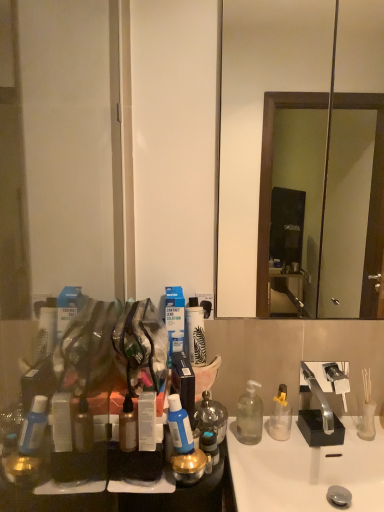
Find the location of a particular element. This screenshot has height=512, width=384. blue translucent bottle at center, which is the 2th bottle in front-to-back order is located at coordinates (179, 426).

Image resolution: width=384 pixels, height=512 pixels. What are the coordinates of `transparent plastic container at center` in the screenshot? It's located at (147, 421).

Identify the location of wooden framed mirror at center. Image resolution: width=384 pixels, height=512 pixels. (259, 119).

Which object is positioned more to the left, white glossy sink at lower center or blue translucent bottle at center, the 3th bottle in the back-to-front sequence?

blue translucent bottle at center, the 3th bottle in the back-to-front sequence, is more to the left.

Is blue translucent bottle at center, the 3th bottle in the back-to-front sequence, at the back of white glossy sink at lower center?

No, white glossy sink at lower center is not facing away from blue translucent bottle at center, the 3th bottle in the back-to-front sequence.

Is transparent glass bottle at lower right, which is the 2th bottle in back-to-front order, a part of blue translucent bottle at center, which is counted as the 3th bottle, starting from the right?

No, transparent glass bottle at lower right, which is the 2th bottle in back-to-front order, is located outside of blue translucent bottle at center, which is counted as the 3th bottle, starting from the right.

Where is `bottle that is the 3rd object located above the transparent glass bottle at lower right, the 3th bottle positioned from the left (from the image's perspective)`? Image resolution: width=384 pixels, height=512 pixels. bottle that is the 3rd object located above the transparent glass bottle at lower right, the 3th bottle positioned from the left (from the image's perspective) is located at coordinates (179, 426).

Between blue translucent bottle at center, which is the 2th bottle in front-to-back order, and transparent glass bottle at lower right, which is counted as the second bottle, starting from the right, which one has larger width?

transparent glass bottle at lower right, which is counted as the second bottle, starting from the right, is wider.

Is blue translucent bottle at center, the 3th bottle in the back-to-front sequence, taller than transparent glass bottle at lower right, which is the 2th bottle in back-to-front order?

No, blue translucent bottle at center, the 3th bottle in the back-to-front sequence, is not taller than transparent glass bottle at lower right, which is the 2th bottle in back-to-front order.

From the image's perspective, is blue translucent bottle at center, the 3th bottle in the back-to-front sequence, above or below metallic silver spray can at lower left, which is the first bottle in left-to-right order?

blue translucent bottle at center, the 3th bottle in the back-to-front sequence, is above metallic silver spray can at lower left, which is the first bottle in left-to-right order.

From a real-world perspective, is blue translucent bottle at center, positioned as the second bottle in left-to-right order, located higher than metallic silver spray can at lower left, the first bottle in the front-to-back sequence?

Yes, from a real-world perspective, blue translucent bottle at center, positioned as the second bottle in left-to-right order, is over metallic silver spray can at lower left, the first bottle in the front-to-back sequence

Which object is further away from the camera, blue translucent bottle at center, positioned as the second bottle in left-to-right order, or metallic silver spray can at lower left, which is the first bottle in left-to-right order?

blue translucent bottle at center, positioned as the second bottle in left-to-right order, is behind.

Is point (127, 399) closer to viewer compared to point (184, 411)?

That is True.

From the image's perspective, who appears lower, metallic silver spray can at lower left, the 4th bottle in the right-to-left sequence, or blue translucent bottle at center, which is the 2th bottle in front-to-back order?

From the image's view, metallic silver spray can at lower left, the 4th bottle in the right-to-left sequence, is below.

Who is bigger, metallic silver spray can at lower left, the 4th bottle in the right-to-left sequence, or blue translucent bottle at center, positioned as the second bottle in left-to-right order?

With larger size is blue translucent bottle at center, positioned as the second bottle in left-to-right order.

Which object is positioned more to the left, transparent glass bottle at lower right, which is the 2th bottle in back-to-front order, or wooden framed mirror at center?

transparent glass bottle at lower right, which is the 2th bottle in back-to-front order, is more to the left.

Which object is more forward, transparent glass bottle at lower right, which is counted as the second bottle, starting from the right, or wooden framed mirror at center?

wooden framed mirror at center is in front.

Is transparent glass bottle at lower right, which is counted as the second bottle, starting from the right, taller than wooden framed mirror at center?

No, transparent glass bottle at lower right, which is counted as the second bottle, starting from the right, is not taller than wooden framed mirror at center.

Measure the distance between transparent glass bottle at lower right, which is counted as the second bottle, starting from the right, and wooden framed mirror at center.

transparent glass bottle at lower right, which is counted as the second bottle, starting from the right, is 6.56 feet away from wooden framed mirror at center.

Considering the positions of objects metallic silver spray can at lower left, which is the first bottle in left-to-right order, and clear plastic bottle at center, the 1th bottle when ordered from right to left, in the image provided, who is behind, metallic silver spray can at lower left, which is the first bottle in left-to-right order, or clear plastic bottle at center, the 1th bottle when ordered from right to left,?

clear plastic bottle at center, the 1th bottle when ordered from right to left, is more distant.

Is point (120, 441) positioned behind point (278, 440)?

No, it is in front of (278, 440).

How many degrees apart are the facing directions of metallic silver spray can at lower left, the fourth bottle positioned from the back, and clear plastic bottle at center, the 1th bottle when ordered from right to left?

1.39 degrees separate the facing orientations of metallic silver spray can at lower left, the fourth bottle positioned from the back, and clear plastic bottle at center, the 1th bottle when ordered from right to left.

Is metallic silver spray can at lower left, which is the first bottle in left-to-right order, positioned far away from clear plastic bottle at center, which ranks as the fourth bottle in front-to-back order?

No.

Does wooden framed mirror at center have a greater height compared to metallic silver spray can at lower left, the fourth bottle positioned from the back?

Yes.

Is wooden framed mirror at center surrounding metallic silver spray can at lower left, the fourth bottle positioned from the back?

No.

Is point (357, 23) closer to camera compared to point (133, 436)?

No, (357, 23) is behind (133, 436).

Considering the positions of objects wooden framed mirror at center and metallic silver spray can at lower left, the 4th bottle in the right-to-left sequence, in the image provided, who is more to the left, wooden framed mirror at center or metallic silver spray can at lower left, the 4th bottle in the right-to-left sequence,?

metallic silver spray can at lower left, the 4th bottle in the right-to-left sequence.

The height and width of the screenshot is (512, 384). I want to click on bottle that is the 3rd object to the left of the white glossy sink at lower center, starting at the anchor, so click(x=179, y=426).

You are a GUI agent. You are given a task and a screenshot of the screen. Output one action in this format:
    pyautogui.click(x=<x>, y=<y>)
    Task: Click on the bottle that is the 3rd one when counting upward from the transparent glass bottle at lower right, which is the 2th bottle in back-to-front order (from the image's perspective)
    Image resolution: width=384 pixels, height=512 pixels.
    Given the screenshot: What is the action you would take?
    click(x=179, y=426)

Looking at the image, which one is located closer to transparent plastic container at center, transparent glass bottle at lower right, which is the third bottle in front-to-back order, or clear plastic bottle at center, the first bottle when ordered from back to front?

Based on the image, transparent glass bottle at lower right, which is the third bottle in front-to-back order, appears to be nearer to transparent plastic container at center.

Estimate the real-world distances between objects in this image. Which object is further from wooden framed mirror at center, clear plastic bottle at center, the first bottle when ordered from back to front, or metallic silver spray can at lower left, the 4th bottle in the right-to-left sequence?

metallic silver spray can at lower left, the 4th bottle in the right-to-left sequence, is further to wooden framed mirror at center.

When comparing their distances from white glossy sink at lower center, does clear plastic bottle at center, placed as the 4th bottle when sorted from left to right, or metallic silver spray can at lower left, which is the first bottle in left-to-right order, seem further?

metallic silver spray can at lower left, which is the first bottle in left-to-right order, is positioned further to the anchor white glossy sink at lower center.

Based on their spatial positions, is metallic silver spray can at lower left, which is the first bottle in left-to-right order, or transparent plastic container at center further from transparent glass bottle at lower right, which is the 2th bottle in back-to-front order?

metallic silver spray can at lower left, which is the first bottle in left-to-right order.

From the image, which object appears to be farther from transparent glass bottle at lower right, the 3th bottle positioned from the left, transparent plastic container at center or metallic silver spray can at lower left, which is the first bottle in left-to-right order?

Based on the image, metallic silver spray can at lower left, which is the first bottle in left-to-right order, appears to be further to transparent glass bottle at lower right, the 3th bottle positioned from the left.

Consider the image. When comparing their distances from transparent glass bottle at lower right, which is the 2th bottle in back-to-front order, does blue translucent bottle at center, which is counted as the 3th bottle, starting from the right, or white glossy sink at lower center seem closer?

The object closer to transparent glass bottle at lower right, which is the 2th bottle in back-to-front order, is white glossy sink at lower center.

Looking at the image, which one is located closer to blue translucent bottle at center, which is the 2th bottle in front-to-back order, transparent glass bottle at lower right, which is the third bottle in front-to-back order, or wooden framed mirror at center?

The object closer to blue translucent bottle at center, which is the 2th bottle in front-to-back order, is transparent glass bottle at lower right, which is the third bottle in front-to-back order.

When comparing their distances from metallic silver spray can at lower left, the first bottle in the front-to-back sequence, does transparent plastic container at center or transparent glass bottle at lower right, the 3th bottle positioned from the left, seem further?

transparent glass bottle at lower right, the 3th bottle positioned from the left, lies further to metallic silver spray can at lower left, the first bottle in the front-to-back sequence, than the other object.

Locate an element on the screen. The image size is (384, 512). bottle between blue translucent bottle at center, the 3th bottle in the back-to-front sequence, and clear plastic bottle at center, the first bottle when ordered from back to front, from left to right is located at coordinates (250, 415).

This screenshot has height=512, width=384. Identify the location of toiletry between wooden framed mirror at center and blue translucent bottle at center, positioned as the second bottle in left-to-right order, from top to bottom. (147, 421).

At what (x,y) coordinates should I click in order to perform the action: click on toiletry between wooden framed mirror at center and white glossy sink at lower center in the vertical direction. Please return your answer as a coordinate pair (x, y). Looking at the image, I should click on 147,421.

Where is `toiletry between wooden framed mirror at center and clear plastic bottle at center, placed as the 4th bottle when sorted from left to right, vertically`? toiletry between wooden framed mirror at center and clear plastic bottle at center, placed as the 4th bottle when sorted from left to right, vertically is located at coordinates (147, 421).